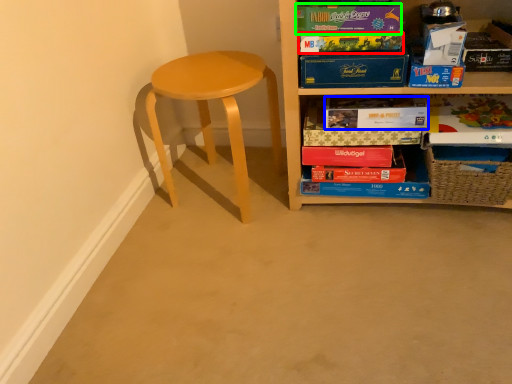
Question: Which object is the farthest from paperback book (highlighted by a red box)? Choose among these: paperback book (highlighted by a blue box) or paperback book (highlighted by a green box).

Choices:
 (A) paperback book
 (B) paperback book

Answer: (A)